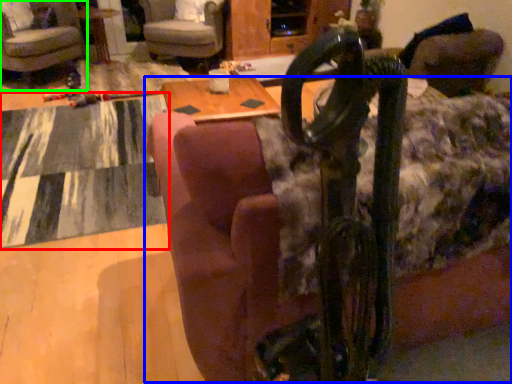
Question: Which object is positioned farthest from mat (highlighted by a red box)? Select from couch (highlighted by a blue box) and chair (highlighted by a green box).

Choices:
 (A) couch
 (B) chair

Answer: (A)